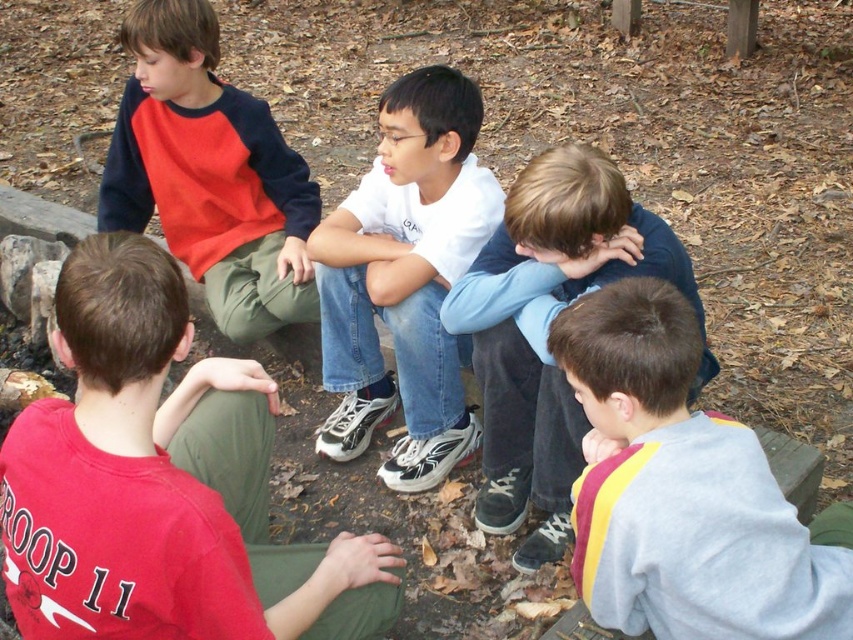
You are a photographer trying to capture a photo of the gray fleece sweatshirt at lower right and the white matte shirt at center. Based on their positions, which object should you focus on first if you want to ensure both are in the frame without moving the camera?

The gray fleece sweatshirt at lower right is located below the white matte shirt at center, so you should focus on the white matte shirt at center first to ensure the gray fleece sweatshirt at lower right stays within the frame.

You are standing in front of the wooden platform where the boys are sitting. Which boy is positioned farther to the right between the white matte shirt at center and the matte red and navy sweatshirt at left?

The white matte shirt at center is positioned farther to the right compared to the matte red and navy sweatshirt at left.

You are a photographer trying to capture a candid shot of the light blue denim jeans at center and the matte red and navy sweatshirt at left. Since you want to ensure both subjects are in focus, you need to know their heights. Which object is taller?

The light blue denim jeans at center is taller than the matte red and navy sweatshirt at left.